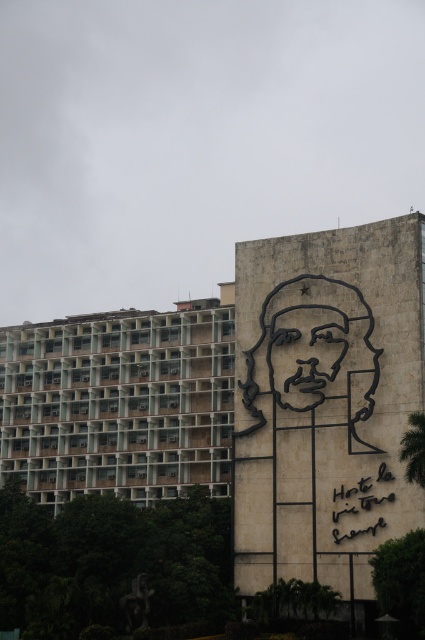
You are an architect analyzing the building and mural in the image. Which object, the concrete building at left or the black line drawing face at center, occupies a larger vertical space in the image?

The concrete building at left has a greater height compared to the black line drawing face at center, so it occupies a larger vertical space in the image.